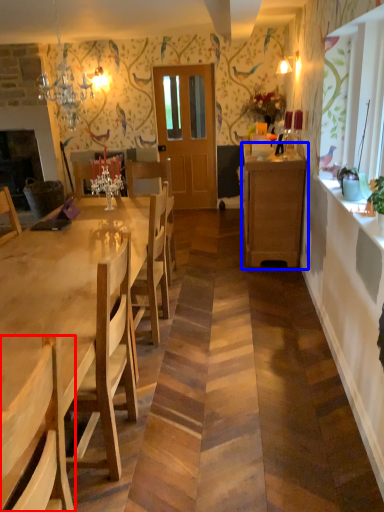
Question: Among these objects, which one is nearest to the camera, chair (highlighted by a red box) or cabinetry (highlighted by a blue box)?

Choices:
 (A) chair
 (B) cabinetry

Answer: (A)